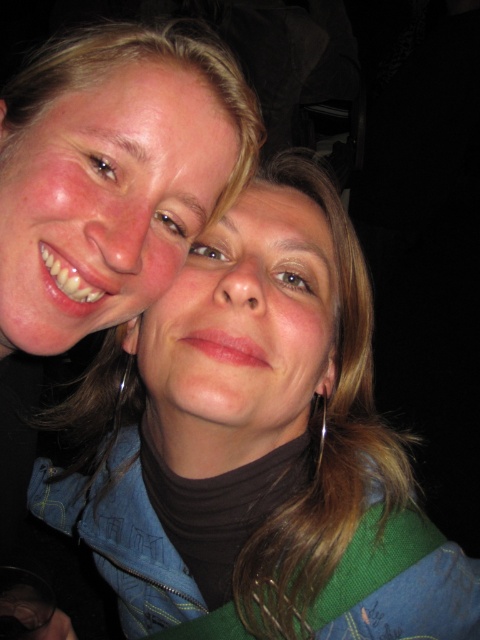
Consider the image. Which of these two, matte blue jacket at upper left or silver metallic earring at lower center, stands shorter?

silver metallic earring at lower center is shorter.

Is point (231, 298) farther from camera compared to point (319, 454)?

No, it is in front of (319, 454).

Identify the location of matte blue jacket at upper left. This screenshot has height=640, width=480. pyautogui.click(x=255, y=445).